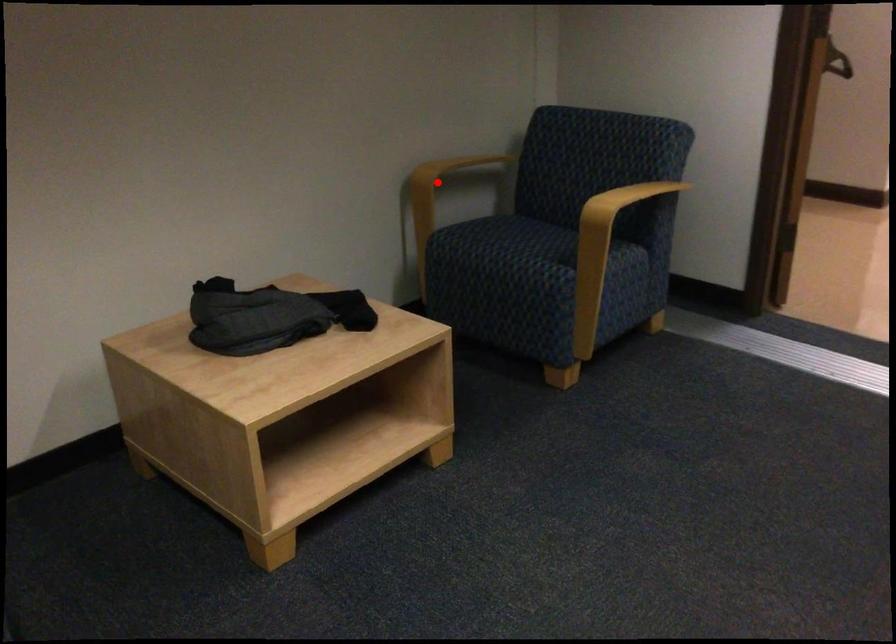
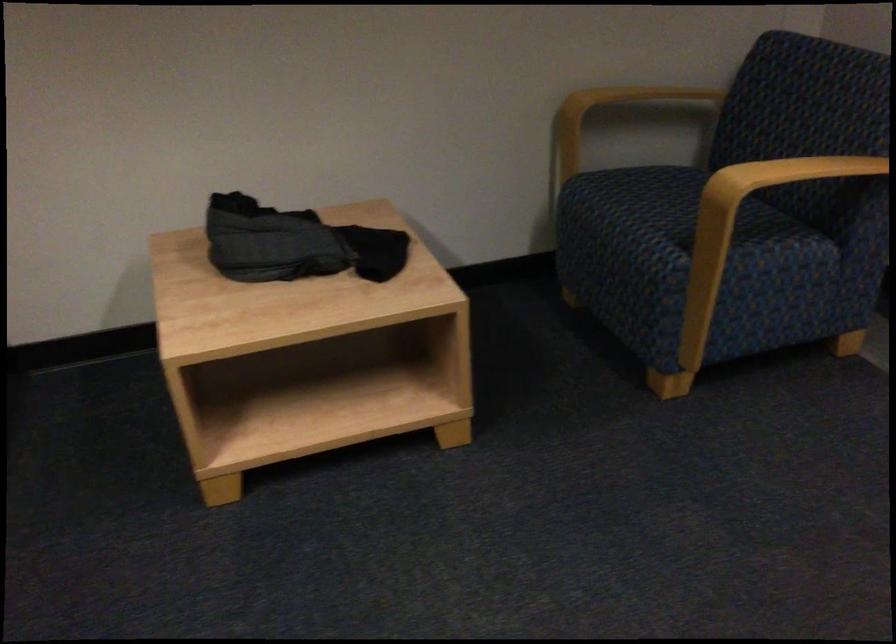
In the second image, find the point that corresponds to the highlighted location in the first image.

(608, 113)